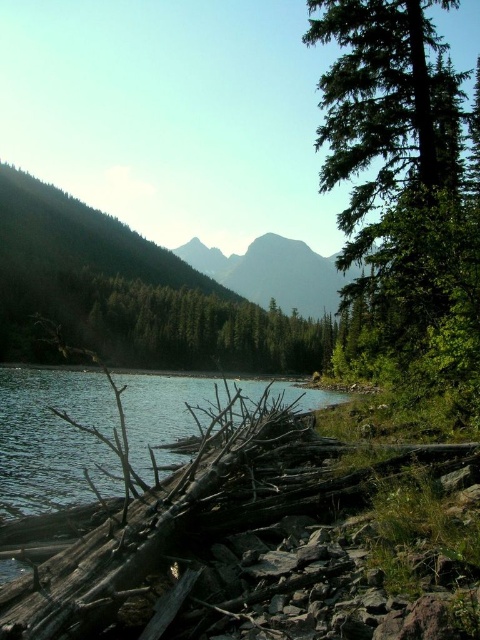
Does green textured tree at right appear over green matte tree at center?

Yes, green textured tree at right is above green matte tree at center.

Who is more forward, (361, 4) or (195, 362)?

Point (361, 4) is more forward.

At what (x,y) coordinates should I click in order to perform the action: click on green textured tree at right. Please return your answer as a coordinate pair (x, y). Looking at the image, I should click on (402, 186).

This screenshot has height=640, width=480. I want to click on green textured tree at right, so (x=402, y=186).

Is green matte tree at center to the left of smooth gray mountain at center from the viewer's perspective?

Yes, green matte tree at center is to the left of smooth gray mountain at center.

Can you confirm if green matte tree at center is wider than smooth gray mountain at center?

In fact, green matte tree at center might be narrower than smooth gray mountain at center.

Does point (199, 324) lie in front of point (203, 262)?

That is True.

At what (x,y) coordinates should I click in order to perform the action: click on green matte tree at center. Please return your answer as a coordinate pair (x, y). Looking at the image, I should click on (196, 330).

Is green textured tree at right positioned before smooth gray mountain at center?

Yes, green textured tree at right is closer to the viewer.

Identify the location of green textured tree at right. (402, 186).